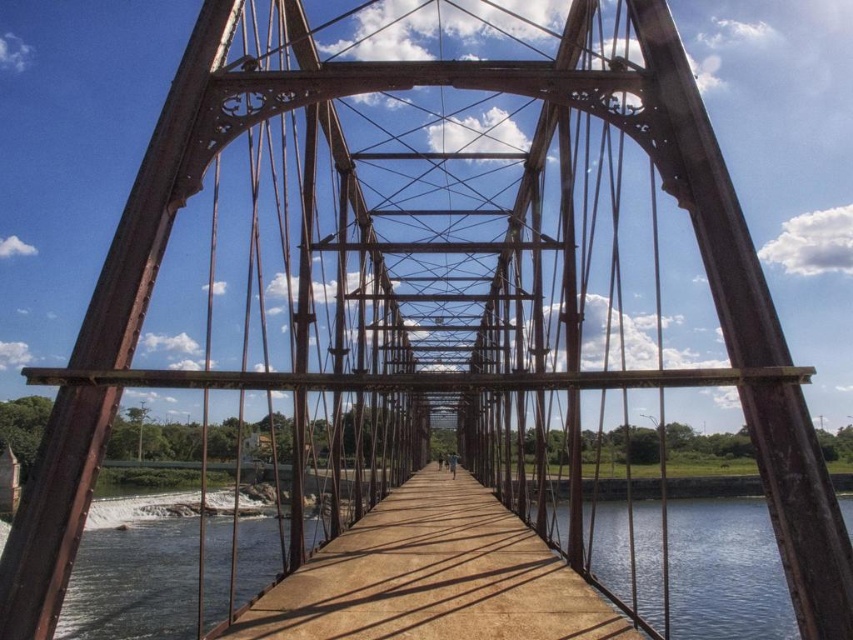
Question: Does smooth concrete river at center appear on the left side of brown wooden bridge at center?

Choices:
 (A) no
 (B) yes

Answer: (A)

Question: Does smooth concrete river at center have a larger size compared to brown wooden bridge at center?

Choices:
 (A) no
 (B) yes

Answer: (B)

Question: Which point is closer to the camera?

Choices:
 (A) (508, 538)
 (B) (82, 602)

Answer: (A)

Question: Does smooth concrete river at center have a smaller size compared to brown wooden bridge at center?

Choices:
 (A) yes
 (B) no

Answer: (B)

Question: Which point appears farthest from the camera in this image?

Choices:
 (A) (605, 547)
 (B) (386, 522)

Answer: (A)

Question: Among these points, which one is farthest from the camera?

Choices:
 (A) (183, 630)
 (B) (393, 577)

Answer: (A)